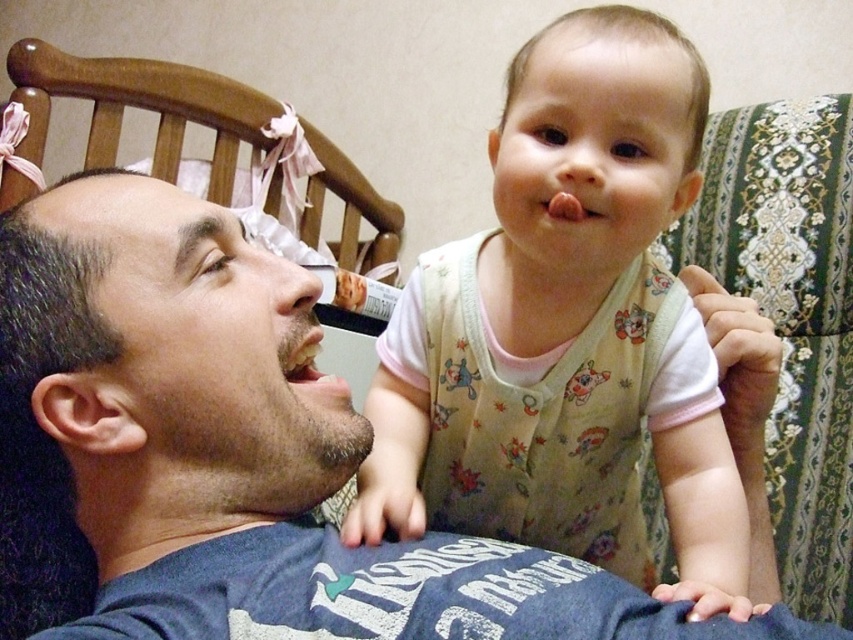
From the picture: Does matte blue t-shirt at center appear on the left side of floral cotton onesie at center?

Correct, you'll find matte blue t-shirt at center to the left of floral cotton onesie at center.

Between point (10, 385) and point (541, 333), which one is positioned in front?

Point (10, 385)

Identify the location of matte blue t-shirt at center. This screenshot has height=640, width=853. tap(225, 456).

You are a GUI agent. You are given a task and a screenshot of the screen. Output one action in this format:
    pyautogui.click(x=<x>, y=<y>)
    Task: Click on the floral cotton onesie at center
    
    Given the screenshot: What is the action you would take?
    pyautogui.click(x=566, y=328)

Who is lower down, floral cotton onesie at center or smooth white teeth at center?

floral cotton onesie at center

Does point (605, 416) come behind point (293, 360)?

Yes, it is behind point (293, 360).

Locate an element on the screen. This screenshot has width=853, height=640. floral cotton onesie at center is located at coordinates (566, 328).

Identify the location of matte blue t-shirt at center. (225, 456).

Is matte blue t-shirt at center below smooth white teeth at center?

Correct, matte blue t-shirt at center is located below smooth white teeth at center.

Which is in front, point (131, 230) or point (318, 381)?

Point (131, 230)

Where is `matte blue t-shirt at center`? The height and width of the screenshot is (640, 853). matte blue t-shirt at center is located at coordinates (225, 456).